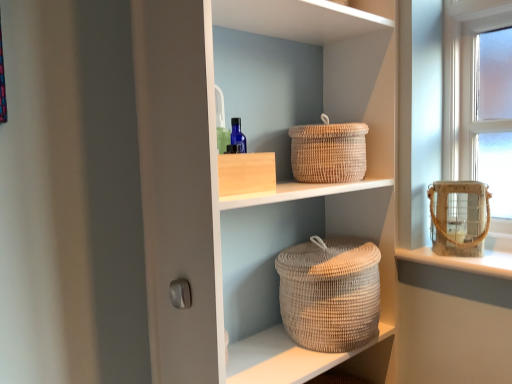
Question: Is natural woven basket at center taller than white glossy door handle at lower left?

Choices:
 (A) yes
 (B) no

Answer: (A)

Question: Does natural woven basket at center have a larger size compared to white glossy door handle at lower left?

Choices:
 (A) yes
 (B) no

Answer: (A)

Question: From a real-world perspective, is natural woven basket at center on white glossy door handle at lower left?

Choices:
 (A) yes
 (B) no

Answer: (A)

Question: Considering the relative positions of natural woven basket at center and white glossy door handle at lower left in the image provided, is natural woven basket at center to the right of white glossy door handle at lower left from the viewer's perspective?

Choices:
 (A) yes
 (B) no

Answer: (A)

Question: Does natural woven basket at center have a lesser width compared to white glossy door handle at lower left?

Choices:
 (A) no
 (B) yes

Answer: (A)

Question: Considering the positions of rustic woven basket at right, the 2th basket container when ordered from bottom to top, and natural woven basket at upper center in the image, is rustic woven basket at right, the 2th basket container when ordered from bottom to top, wider or thinner than natural woven basket at upper center?

Choices:
 (A) thin
 (B) wide

Answer: (A)

Question: Is rustic woven basket at right, the 2th basket container when ordered from bottom to top, bigger or smaller than natural woven basket at upper center?

Choices:
 (A) small
 (B) big

Answer: (A)

Question: Visually, is rustic woven basket at right, which is counted as the 1th basket container, starting from the right, positioned to the left or to the right of natural woven basket at upper center?

Choices:
 (A) right
 (B) left

Answer: (A)

Question: From a real-world perspective, is rustic woven basket at right, which is counted as the first basket container, starting from the top, physically located above or below natural woven basket at upper center?

Choices:
 (A) above
 (B) below

Answer: (B)

Question: Looking at the image, does rustic woven basket at right, the 2th basket container when ordered from bottom to top, seem bigger or smaller compared to white glossy door handle at lower left?

Choices:
 (A) small
 (B) big

Answer: (B)

Question: From a real-world perspective, is rustic woven basket at right, which is counted as the first basket container, starting from the top, above or below white glossy door handle at lower left?

Choices:
 (A) below
 (B) above

Answer: (B)

Question: Does point (432, 187) appear closer or farther from the camera than point (178, 294)?

Choices:
 (A) closer
 (B) farther

Answer: (B)

Question: In the image, is rustic woven basket at right, which is counted as the 1th basket container, starting from the right, on the left side or the right side of white glossy door handle at lower left?

Choices:
 (A) right
 (B) left

Answer: (A)

Question: Is neutral woven basket at center, which is counted as the 2th basket container, starting from the right, wider or thinner than natural woven basket at center?

Choices:
 (A) wide
 (B) thin

Answer: (B)

Question: From the image's perspective, is neutral woven basket at center, marked as the 1th basket container in a bottom-to-top arrangement, located above or below natural woven basket at center?

Choices:
 (A) above
 (B) below

Answer: (B)